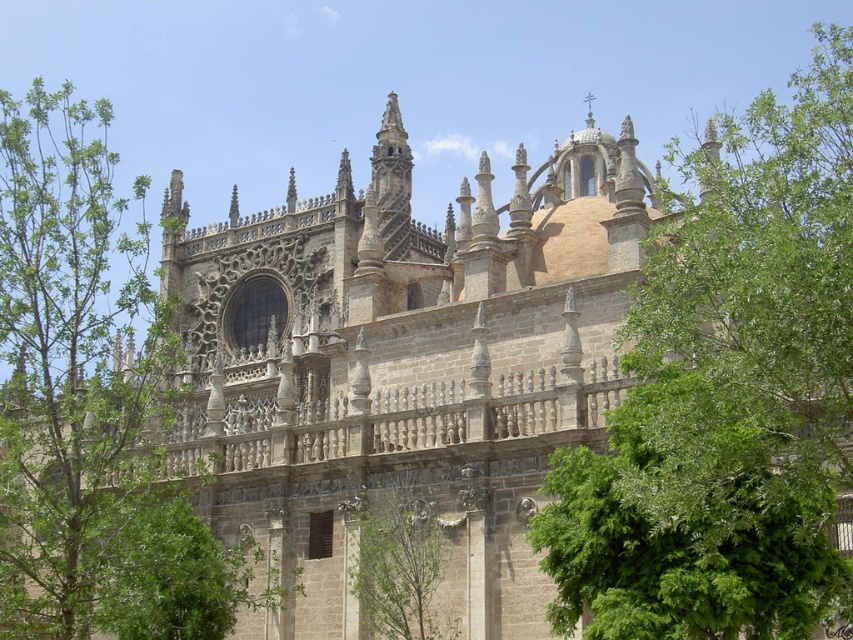
Measure the distance from green leafy tree at upper right to green leafy tree at center.

green leafy tree at upper right and green leafy tree at center are 29.19 meters apart from each other.

The image size is (853, 640). Identify the location of green leafy tree at upper right. (727, 394).

Is point (630, 483) positioned before point (395, 516)?

Yes, it is.

Find the location of `green leafy tree at upper right`. green leafy tree at upper right is located at coordinates (727, 394).

Describe the element at coordinates (91, 403) in the screenshot. I see `green leafy tree at left` at that location.

Who is more forward, (35, 308) or (376, 525)?

Positioned in front is point (35, 308).

Locate an element on the screen. This screenshot has height=640, width=853. green leafy tree at left is located at coordinates (91, 403).

Can you confirm if green leafy tree at upper right is positioned above green leafy tree at left?

Indeed, green leafy tree at upper right is positioned over green leafy tree at left.

Which of these two, green leafy tree at upper right or green leafy tree at left, stands shorter?

Standing shorter between the two is green leafy tree at left.

Which is in front, point (759, 628) or point (155, 554)?

Point (759, 628) is in front.

At what (x,y) coordinates should I click in order to perform the action: click on green leafy tree at upper right. Please return your answer as a coordinate pair (x, y). Looking at the image, I should click on (727, 394).